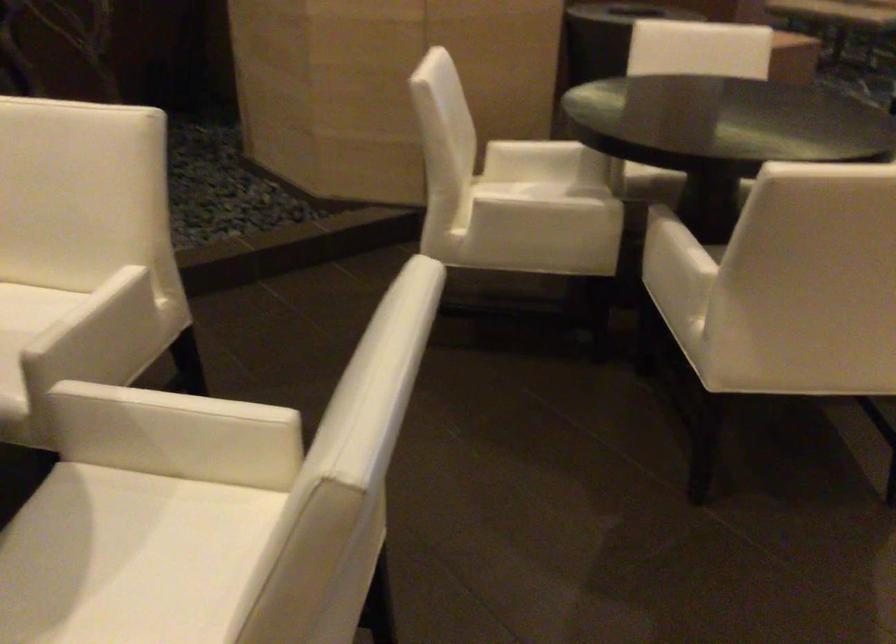
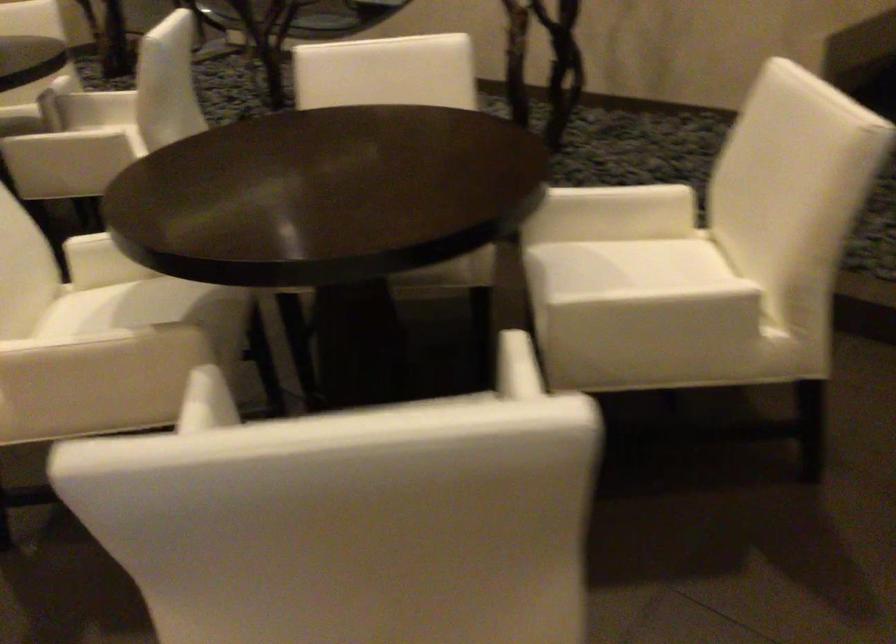
How did the camera likely rotate?

The rotation direction of the camera is left-down.